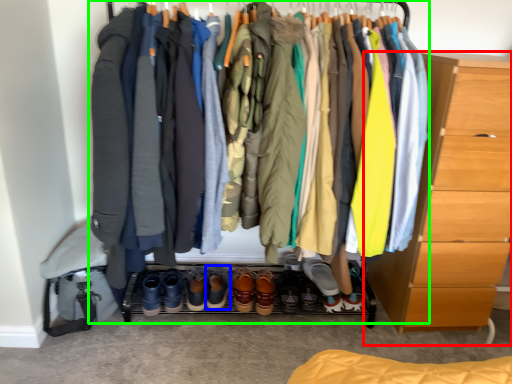
Question: Which is farther away from chest of drawers (highlighted by a red box)? footwear (highlighted by a blue box) or closet (highlighted by a green box)?

Choices:
 (A) footwear
 (B) closet

Answer: (A)